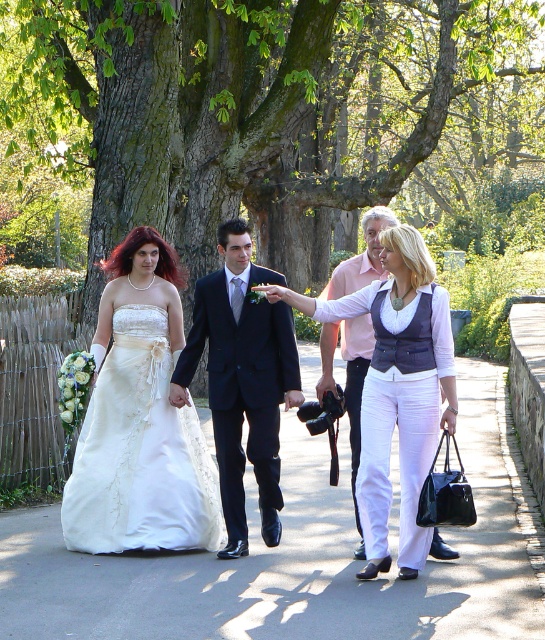
Question: Which of these objects is positioned farthest from the dark blue suit at center?

Choices:
 (A) light pink fabric shirt at center
 (B) satin white dress at center
 (C) ivory satin dress at left
 (D) white satin dress at center

Answer: (D)

Question: Among these points, which one is farthest from the camera?

Choices:
 (A) (404, 250)
 (B) (216, 355)

Answer: (B)

Question: Which point is farther to the camera?

Choices:
 (A) (397, 406)
 (B) (360, 412)
 (C) (107, 548)

Answer: (C)

Question: Is satin white dress at center further to camera compared to light pink fabric shirt at center?

Choices:
 (A) yes
 (B) no

Answer: (B)

Question: Can you confirm if ivory satin dress at left is bigger than dark blue suit at center?

Choices:
 (A) no
 (B) yes

Answer: (A)

Question: Does ivory satin dress at left appear on the right side of dark blue suit at center?

Choices:
 (A) yes
 (B) no

Answer: (B)